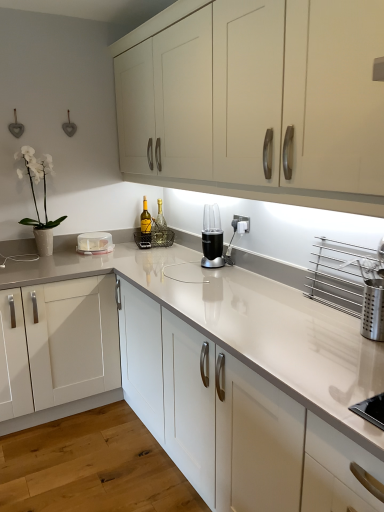
Question: Considering the relative positions of clear glass bottle at center, arranged as the first bottle when viewed from the right, and black plastic blender at center in the image provided, is clear glass bottle at center, arranged as the first bottle when viewed from the right, in front of black plastic blender at center?

Choices:
 (A) no
 (B) yes

Answer: (A)

Question: Is clear glass bottle at center, which appears as the 2th bottle when viewed from the left, aimed at black plastic blender at center?

Choices:
 (A) yes
 (B) no

Answer: (B)

Question: Does clear glass bottle at center, which appears as the 2th bottle when viewed from the left, have a greater width compared to black plastic blender at center?

Choices:
 (A) no
 (B) yes

Answer: (A)

Question: Is clear glass bottle at center, which appears as the 2th bottle when viewed from the left, positioned with its back to black plastic blender at center?

Choices:
 (A) yes
 (B) no

Answer: (B)

Question: From a real-world perspective, is clear glass bottle at center, arranged as the first bottle when viewed from the right, located beneath black plastic blender at center?

Choices:
 (A) yes
 (B) no

Answer: (A)

Question: Is clear glass bottle at center, which appears as the 2th bottle when viewed from the left, outside of black plastic blender at center?

Choices:
 (A) yes
 (B) no

Answer: (A)

Question: Is white glossy countertop at center shorter than white glossy vase at upper left?

Choices:
 (A) no
 (B) yes

Answer: (A)

Question: Is white glossy countertop at center thinner than white glossy vase at upper left?

Choices:
 (A) no
 (B) yes

Answer: (A)

Question: Can you confirm if white glossy countertop at center is bigger than white glossy vase at upper left?

Choices:
 (A) no
 (B) yes

Answer: (B)

Question: Is white glossy countertop at center beside white glossy vase at upper left?

Choices:
 (A) no
 (B) yes

Answer: (A)

Question: Does white glossy countertop at center have a greater height compared to white glossy vase at upper left?

Choices:
 (A) no
 (B) yes

Answer: (B)

Question: Are white glossy countertop at center and white glossy vase at upper left located far from each other?

Choices:
 (A) no
 (B) yes

Answer: (B)

Question: Is clear glass bottle at center, arranged as the first bottle when viewed from the right, surrounded by white glossy countertop at center?

Choices:
 (A) yes
 (B) no

Answer: (A)